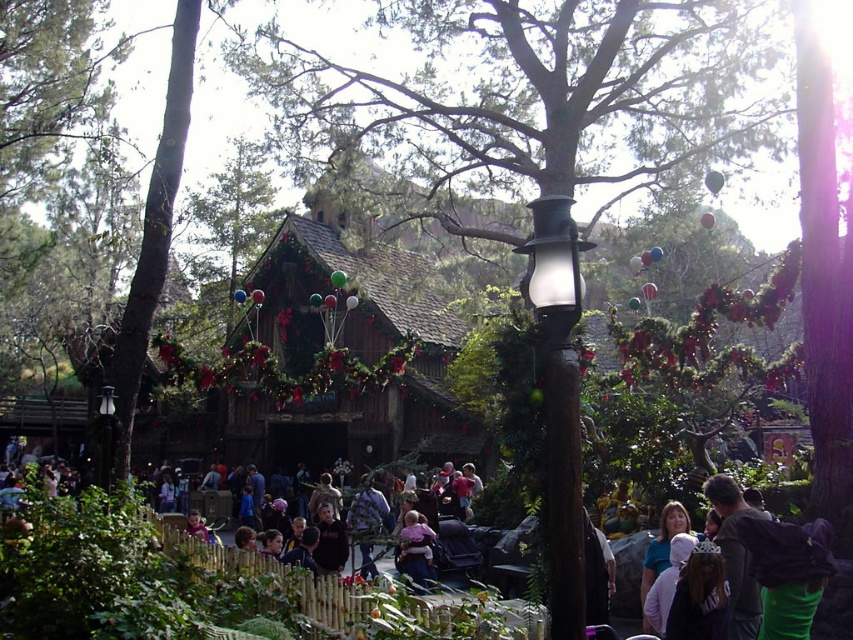
In the scene shown: You are a visitor at the theme park and want to take a photo of both the wooden log cabin at center and the transparent glass lamp post at upper center. Which object should you focus on first to ensure both are in frame?

You should focus on the wooden log cabin at center first because it is taller than the transparent glass lamp post at upper center, so positioning it properly will help frame both objects effectively.